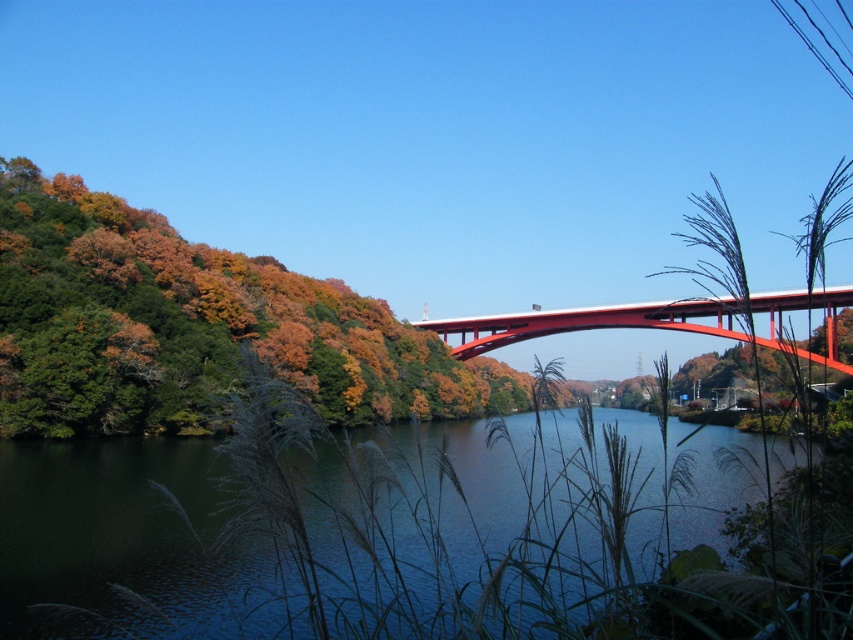
Question: Is dark blue water at center further to the viewer compared to autumn leaves at left?

Choices:
 (A) no
 (B) yes

Answer: (A)

Question: Is dark blue water at center wider than autumn leaves at left?

Choices:
 (A) no
 (B) yes

Answer: (A)

Question: Which point is closer to the camera?

Choices:
 (A) (590, 316)
 (B) (7, 493)
 (C) (4, 314)

Answer: (B)

Question: Among these points, which one is farthest from the camera?

Choices:
 (A) (843, 368)
 (B) (231, 596)

Answer: (A)

Question: Which point appears closest to the camera in this image?

Choices:
 (A) (457, 337)
 (B) (74, 294)

Answer: (B)

Question: Is dark blue water at center closer to camera compared to autumn leaves at left?

Choices:
 (A) yes
 (B) no

Answer: (A)